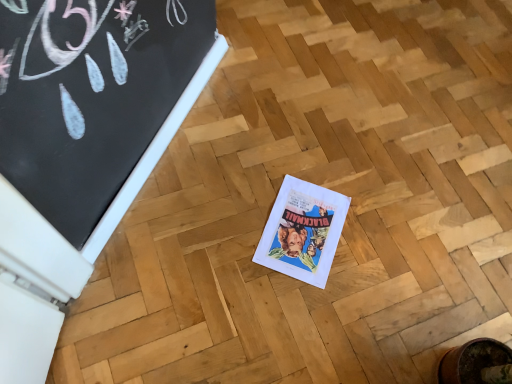
What is the approximate width of white paper comic book at center?

8.78 inches.

What do you see at coordinates (303, 231) in the screenshot?
I see `white paper comic book at center` at bounding box center [303, 231].

Find the location of `white paper comic book at center`. white paper comic book at center is located at coordinates (303, 231).

This screenshot has height=384, width=512. Describe the element at coordinates (90, 96) in the screenshot. I see `black chalkboard at upper left` at that location.

Locate an element on the screen. Image resolution: width=512 pixels, height=384 pixels. black chalkboard at upper left is located at coordinates (90, 96).

Locate an element on the screen. The height and width of the screenshot is (384, 512). white paper comic book at center is located at coordinates (303, 231).

From the picture: In the image, is black chalkboard at upper left on the left side or the right side of white paper comic book at center?

black chalkboard at upper left is to the left of white paper comic book at center.

Considering their positions, is black chalkboard at upper left located in front of or behind white paper comic book at center?

Visually, black chalkboard at upper left is located in front of white paper comic book at center.

Is point (39, 36) closer to camera compared to point (302, 278)?

Yes, it is.

From the image's perspective, which one is positioned lower, black chalkboard at upper left or white paper comic book at center?

white paper comic book at center, from the image's perspective.

From a real-world perspective, is black chalkboard at upper left under white paper comic book at center?

Incorrect, from a real-world perspective, black chalkboard at upper left is higher than white paper comic book at center.

Between black chalkboard at upper left and white paper comic book at center, which one has larger width?

white paper comic book at center.

Considering the relative sizes of black chalkboard at upper left and white paper comic book at center in the image provided, is black chalkboard at upper left taller than white paper comic book at center?

Yes.

Can you confirm if black chalkboard at upper left is smaller than white paper comic book at center?

No.

Is white paper comic book at center surrounded by black chalkboard at upper left?

No, white paper comic book at center is not surrounded by black chalkboard at upper left.

Is there a large distance between black chalkboard at upper left and white paper comic book at center?

That's not correct — black chalkboard at upper left is a little close to white paper comic book at center.

Is black chalkboard at upper left facing away from white paper comic book at center?

No, black chalkboard at upper left is not facing the opposite direction of white paper comic book at center.

How many degrees apart are the facing directions of black chalkboard at upper left and white paper comic book at center?

They differ by 177 degrees in their facing directions.

The image size is (512, 384). What are the coordinates of `bulletin board located in front of the white paper comic book at center` in the screenshot? It's located at (90, 96).

Can you confirm if white paper comic book at center is positioned to the left of black chalkboard at upper left?

In fact, white paper comic book at center is to the right of black chalkboard at upper left.

Which object is further away from the camera, white paper comic book at center or black chalkboard at upper left?

white paper comic book at center is further from the camera.

Is point (279, 213) farther from viewer compared to point (115, 44)?

Yes, point (279, 213) is farther from viewer.

Consider the image. From the image's perspective, which is above, white paper comic book at center or black chalkboard at upper left?

black chalkboard at upper left.

From a real-world perspective, is white paper comic book at center above or below black chalkboard at upper left?

Clearly, from a real-world perspective, white paper comic book at center is below black chalkboard at upper left.

Based on the photo, is white paper comic book at center thinner than black chalkboard at upper left?

In fact, white paper comic book at center might be wider than black chalkboard at upper left.

Considering the sizes of objects white paper comic book at center and black chalkboard at upper left in the image provided, who is shorter, white paper comic book at center or black chalkboard at upper left?

white paper comic book at center is shorter.

Who is bigger, white paper comic book at center or black chalkboard at upper left?

black chalkboard at upper left.

Is white paper comic book at center inside the boundaries of black chalkboard at upper left, or outside?

The correct answer is: outside.

Is white paper comic book at center positioned far away from black chalkboard at upper left?

No, there isn't a large distance between white paper comic book at center and black chalkboard at upper left.

Is white paper comic book at center looking in the opposite direction of black chalkboard at upper left?

No, white paper comic book at center is not facing away from black chalkboard at upper left.

Identify the location of bulletin board in front of the white paper comic book at center. The height and width of the screenshot is (384, 512). (90, 96).

In the image, there is a black chalkboard at upper left. Identify the location of comic book below it (from the image's perspective). (303, 231).

I want to click on comic book on the right of black chalkboard at upper left, so click(x=303, y=231).